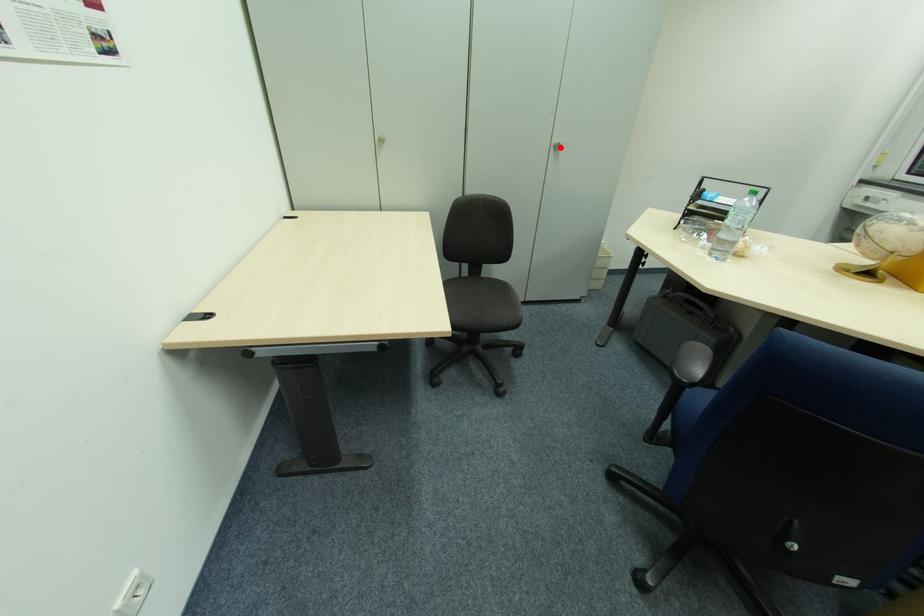
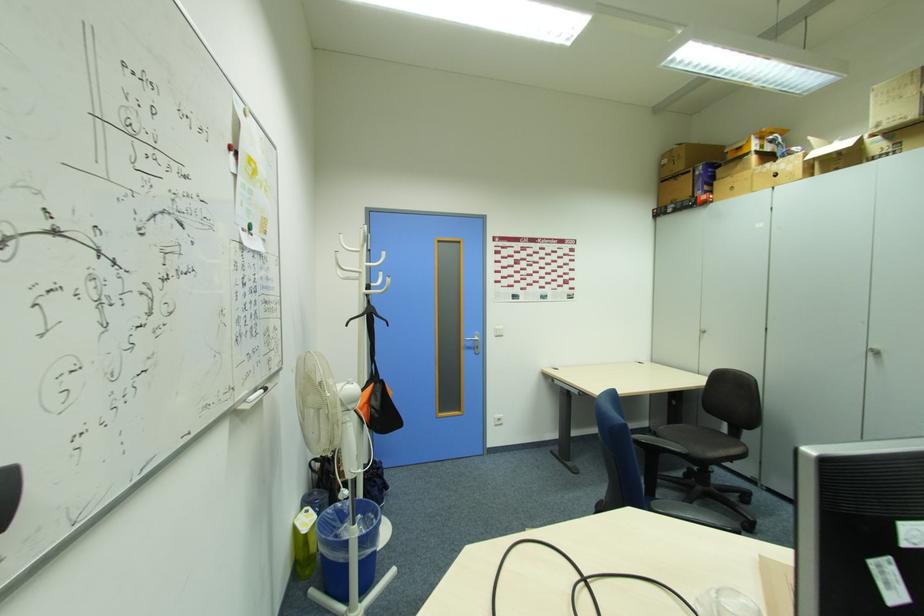
Find the pixel in the second image that matches the highlighted location in the first image.

(880, 354)